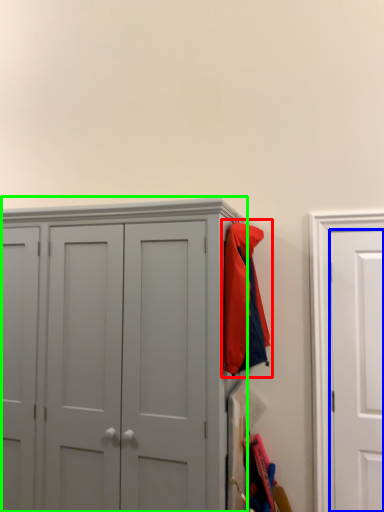
Question: Estimate the real-world distances between objects in this image. Which object is closer to jacket (highlighted by a red box), door (highlighted by a blue box) or cupboard (highlighted by a green box)?

Choices:
 (A) door
 (B) cupboard

Answer: (B)